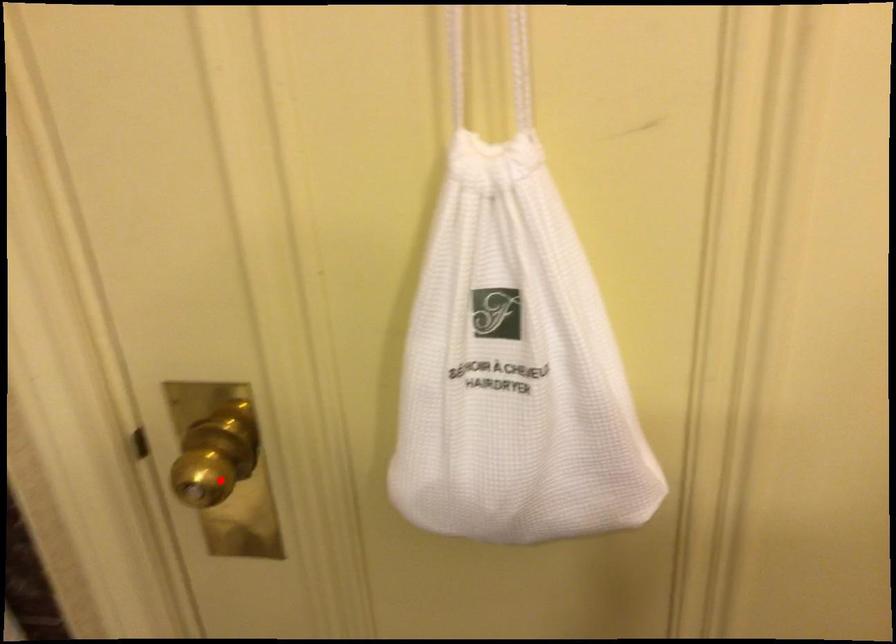
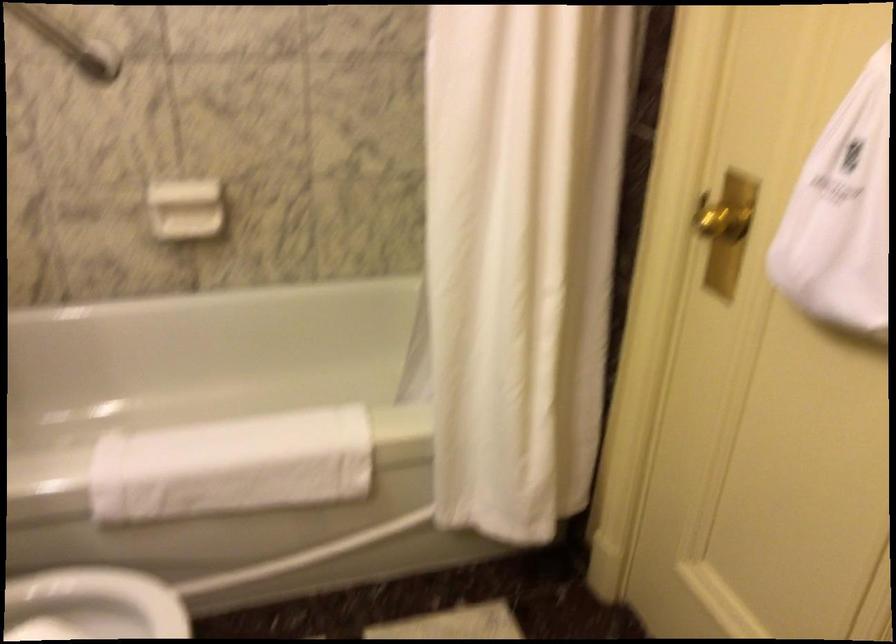
Question: I am providing you with two images of the same scene from different viewpoints. In image1, a red point is highlighted. Considering the same 3D point in image2, which of the following is correct?

Choices:
 (A) It is closer
 (B) It is farther

Answer: (B)